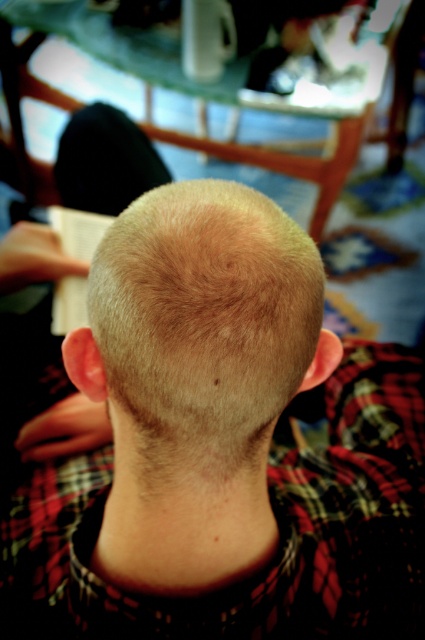
You are a stylist observing a client in a salon. You notice two instances of hair described as blonde hair at center and blonde smooth hair at center. Which one is closer to you?

The blonde hair at center is closer to you as it is positioned in front of the blonde smooth hair at center.

You are a hairstylist assessing a client with two distinct hair sections on their head. The first section is labeled as blonde hair at center and the second as blonde smooth hair at center. Based on the scene description, which hair section is taller?

The blonde hair at center is much taller than the blonde smooth hair at center according to the description.

You are standing in the barbershop and see two points in the image. Which point is closer to you, point (255, 374) or point (146, 208)?

Point (255, 374) is in front of point (146, 208), so it is closer to you.